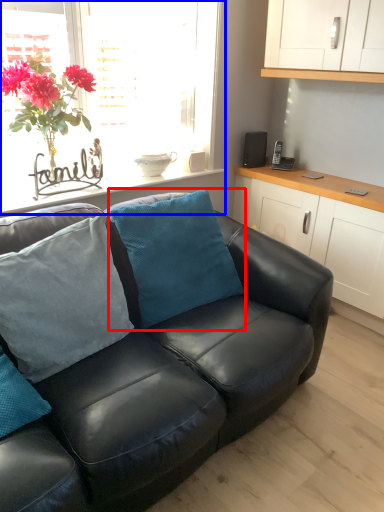
Question: Which object is closer to the camera taking this photo, pillow (highlighted by a red box) or window (highlighted by a blue box)?

Choices:
 (A) pillow
 (B) window

Answer: (A)